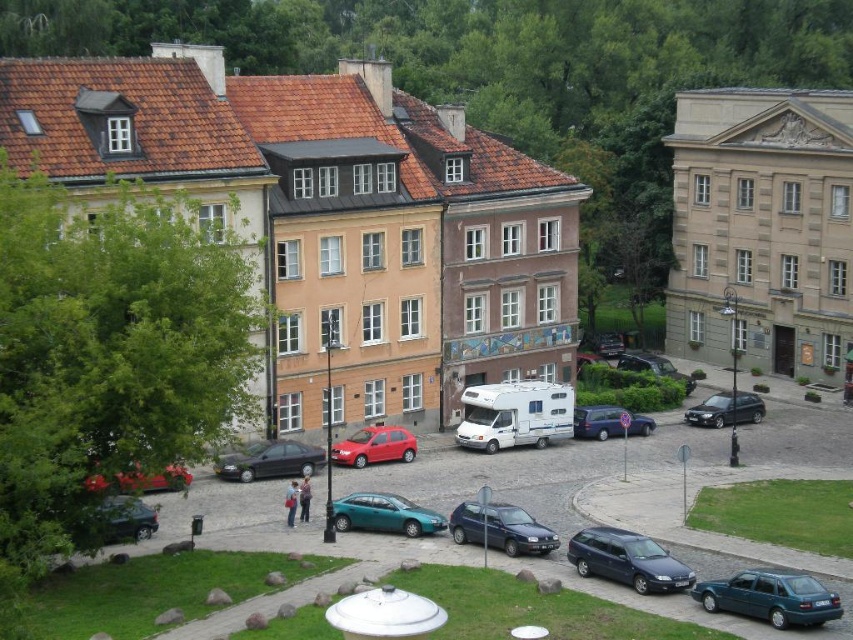
Is matte black sedan at center above metallic blue van at center?

Incorrect, matte black sedan at center is not positioned above metallic blue van at center.

Can you confirm if matte black sedan at center is positioned to the left of metallic blue van at center?

Correct, you'll find matte black sedan at center to the left of metallic blue van at center.

You are a GUI agent. You are given a task and a screenshot of the screen. Output one action in this format:
    pyautogui.click(x=<x>, y=<y>)
    Task: Click on the matte black sedan at center
    
    Given the screenshot: What is the action you would take?
    pyautogui.click(x=270, y=460)

Does matte black sedan at center appear on the right side of metallic silver car at center?

In fact, matte black sedan at center is to the left of metallic silver car at center.

Between matte black sedan at center and metallic silver car at center, which one has more height?

metallic silver car at center

Where is `matte black sedan at center`? The height and width of the screenshot is (640, 853). matte black sedan at center is located at coordinates 270,460.

Locate an element on the screen. This screenshot has height=640, width=853. matte black sedan at center is located at coordinates (270, 460).

Between metallic blue hatchback at lower right and metallic silver car at center, which one appears on the left side from the viewer's perspective?

Positioned to the left is metallic blue hatchback at lower right.

Which is in front, point (693, 589) or point (663, 356)?

Point (693, 589) is more forward.

Is point (773, 614) behind point (669, 374)?

That is False.

Find the location of a particular element. The image size is (853, 640). metallic blue hatchback at lower right is located at coordinates (770, 596).